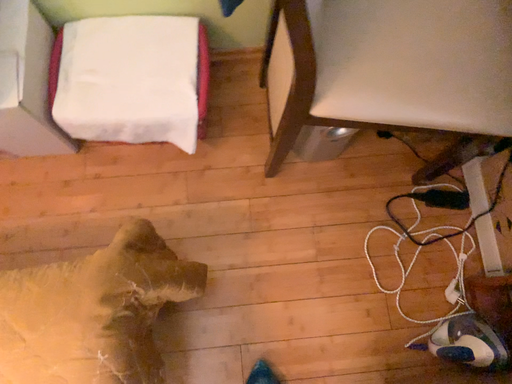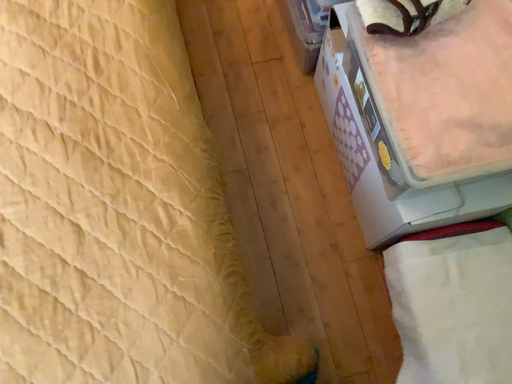
Question: How did the camera likely rotate when shooting the video?

Choices:
 (A) rotated right
 (B) rotated left

Answer: (B)